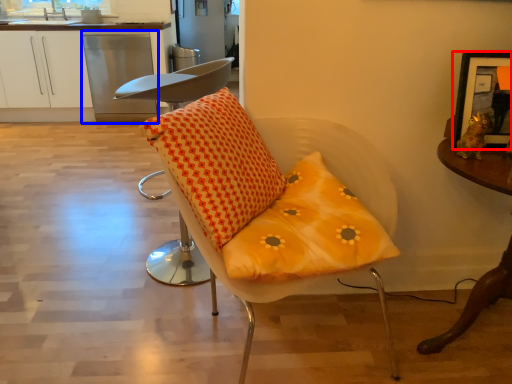
Question: Among these objects, which one is farthest to the camera, picture frame (highlighted by a red box) or dish washer (highlighted by a blue box)?

Choices:
 (A) picture frame
 (B) dish washer

Answer: (B)